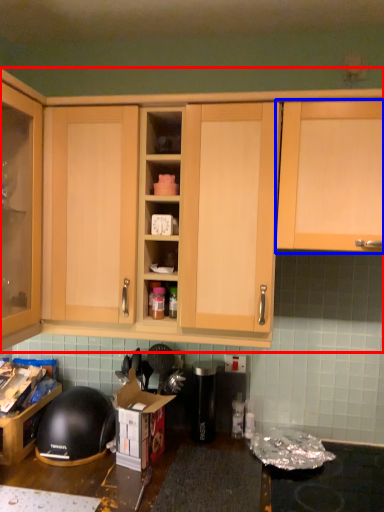
Question: Which object is further to the camera taking this photo, cabinetry (highlighted by a red box) or cabinetry (highlighted by a blue box)?

Choices:
 (A) cabinetry
 (B) cabinetry

Answer: (A)